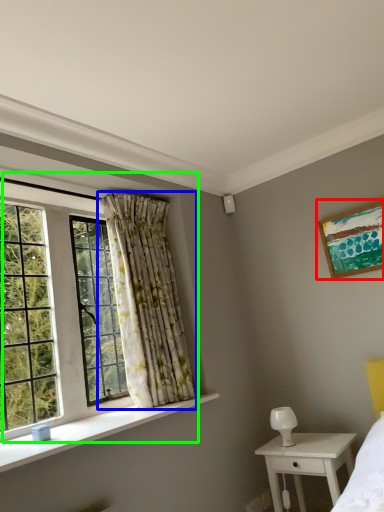
Question: Which object is positioned farthest from picture frame (highlighted by a red box)? Select from curtain (highlighted by a blue box) and window (highlighted by a green box).

Choices:
 (A) curtain
 (B) window

Answer: (B)